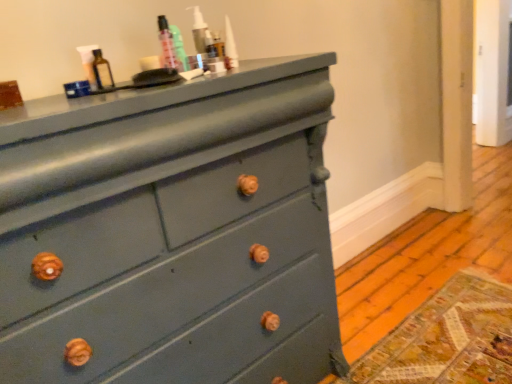
Question: Can you confirm if matte glass bottle at upper center is positioned to the left of teal glossy bottle at upper center?

Choices:
 (A) no
 (B) yes

Answer: (B)

Question: Can you confirm if matte glass bottle at upper center is smaller than teal glossy bottle at upper center?

Choices:
 (A) yes
 (B) no

Answer: (B)

Question: Can you confirm if matte glass bottle at upper center is shorter than teal glossy bottle at upper center?

Choices:
 (A) yes
 (B) no

Answer: (A)

Question: Can you confirm if matte glass bottle at upper center is wider than teal glossy bottle at upper center?

Choices:
 (A) yes
 (B) no

Answer: (A)

Question: Could you tell me if matte glass bottle at upper center is turned towards teal glossy bottle at upper center?

Choices:
 (A) no
 (B) yes

Answer: (A)

Question: Is teal glossy bottle at upper center inside or outside of matte teal dresser at center?

Choices:
 (A) outside
 (B) inside

Answer: (A)

Question: Considering the positions of teal glossy bottle at upper center and matte teal dresser at center in the image, is teal glossy bottle at upper center wider or thinner than matte teal dresser at center?

Choices:
 (A) thin
 (B) wide

Answer: (A)

Question: Considering the positions of point (180, 44) and point (185, 266), is point (180, 44) closer or farther from the camera than point (185, 266)?

Choices:
 (A) farther
 (B) closer

Answer: (A)

Question: Looking at the image, does teal glossy bottle at upper center seem bigger or smaller compared to matte teal dresser at center?

Choices:
 (A) big
 (B) small

Answer: (B)

Question: Is matte glass bottle at upper center wider or thinner than teal glossy bottle at upper center?

Choices:
 (A) thin
 (B) wide

Answer: (B)

Question: From their relative heights in the image, would you say matte glass bottle at upper center is taller or shorter than teal glossy bottle at upper center?

Choices:
 (A) tall
 (B) short

Answer: (B)

Question: Is matte glass bottle at upper center inside or outside of teal glossy bottle at upper center?

Choices:
 (A) inside
 (B) outside

Answer: (B)

Question: From a real-world perspective, is matte glass bottle at upper center positioned above or below teal glossy bottle at upper center?

Choices:
 (A) above
 (B) below

Answer: (B)

Question: In the image, is teal glossy bottle at upper center positioned in front of or behind matte glass bottle at upper center?

Choices:
 (A) behind
 (B) front

Answer: (A)

Question: Would you say teal glossy bottle at upper center is inside or outside matte glass bottle at upper center?

Choices:
 (A) outside
 (B) inside

Answer: (A)